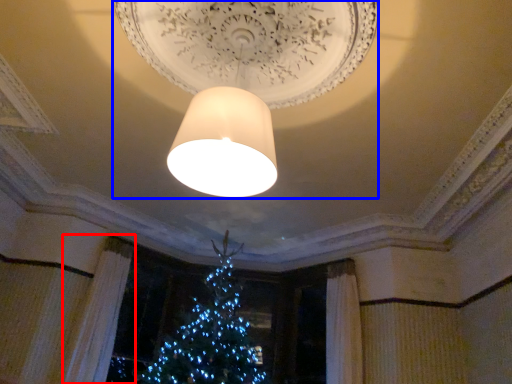
Question: Among these objects, which one is nearest to the camera, curtain (highlighted by a red box) or lamp (highlighted by a blue box)?

Choices:
 (A) curtain
 (B) lamp

Answer: (B)